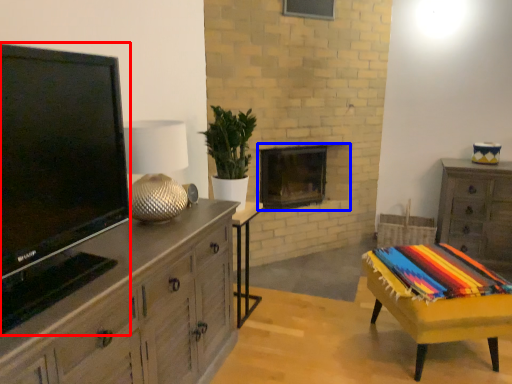
Question: Which point is closer to the camera, television (highlighted by a red box) or fireplace (highlighted by a blue box)?

Choices:
 (A) television
 (B) fireplace

Answer: (A)